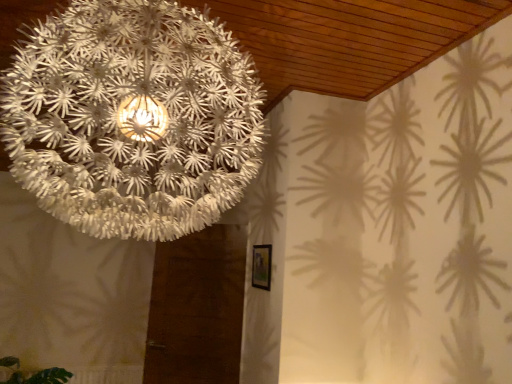
Question: Is green leafy plant at lower left bigger than white paper lampshade at upper center?

Choices:
 (A) yes
 (B) no

Answer: (B)

Question: Is green leafy plant at lower left at the left side of white paper lampshade at upper center?

Choices:
 (A) no
 (B) yes

Answer: (B)

Question: Is green leafy plant at lower left not close to white paper lampshade at upper center?

Choices:
 (A) yes
 (B) no

Answer: (A)

Question: From a real-world perspective, does green leafy plant at lower left stand above white paper lampshade at upper center?

Choices:
 (A) no
 (B) yes

Answer: (A)

Question: Is green leafy plant at lower left touching white paper lampshade at upper center?

Choices:
 (A) no
 (B) yes

Answer: (A)

Question: Is green leafy plant at lower left outside of white paper lampshade at upper center?

Choices:
 (A) no
 (B) yes

Answer: (B)

Question: Does white paper lampshade at upper center turn towards green leafy plant at lower left?

Choices:
 (A) yes
 (B) no

Answer: (B)

Question: Is white paper lampshade at upper center to the left of green leafy plant at lower left from the viewer's perspective?

Choices:
 (A) yes
 (B) no

Answer: (B)

Question: From a real-world perspective, is white paper lampshade at upper center below green leafy plant at lower left?

Choices:
 (A) no
 (B) yes

Answer: (A)

Question: Is white paper lampshade at upper center at the right side of green leafy plant at lower left?

Choices:
 (A) no
 (B) yes

Answer: (B)

Question: Are white paper lampshade at upper center and green leafy plant at lower left beside each other?

Choices:
 (A) yes
 (B) no

Answer: (B)

Question: Does white paper lampshade at upper center have a smaller size compared to green leafy plant at lower left?

Choices:
 (A) yes
 (B) no

Answer: (B)

Question: From the image's perspective, is white paper lampshade at upper center above or below green leafy plant at lower left?

Choices:
 (A) below
 (B) above

Answer: (B)